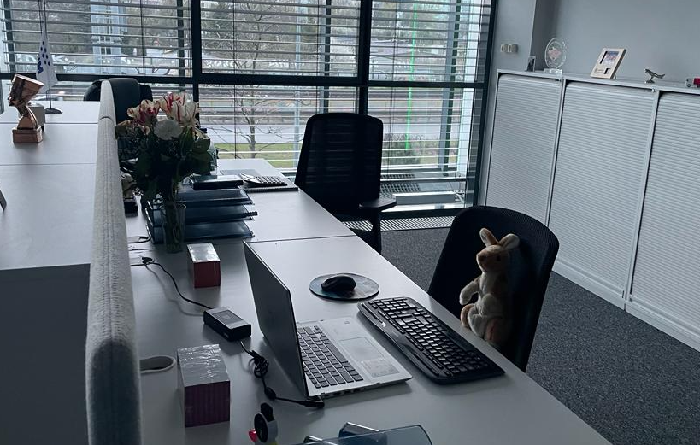
This screenshot has height=445, width=700. I want to click on 1 laptop, so click(x=280, y=309).